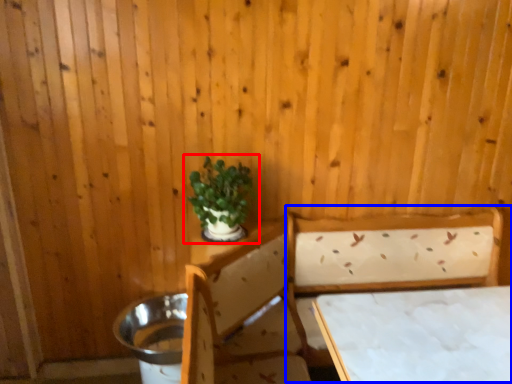
Question: Which object is further to the camera taking this photo, houseplant (highlighted by a red box) or bed (highlighted by a blue box)?

Choices:
 (A) houseplant
 (B) bed

Answer: (A)